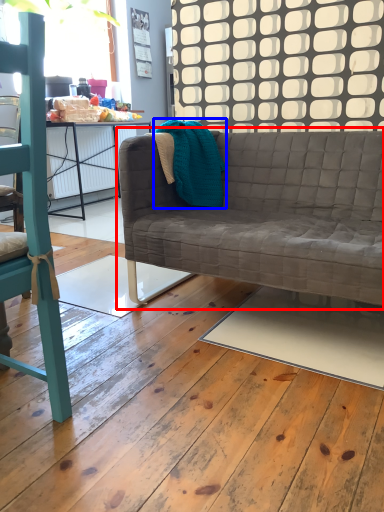
Question: Which object appears farthest to the camera in this image, studio couch (highlighted by a red box) or material (highlighted by a blue box)?

Choices:
 (A) studio couch
 (B) material

Answer: (B)